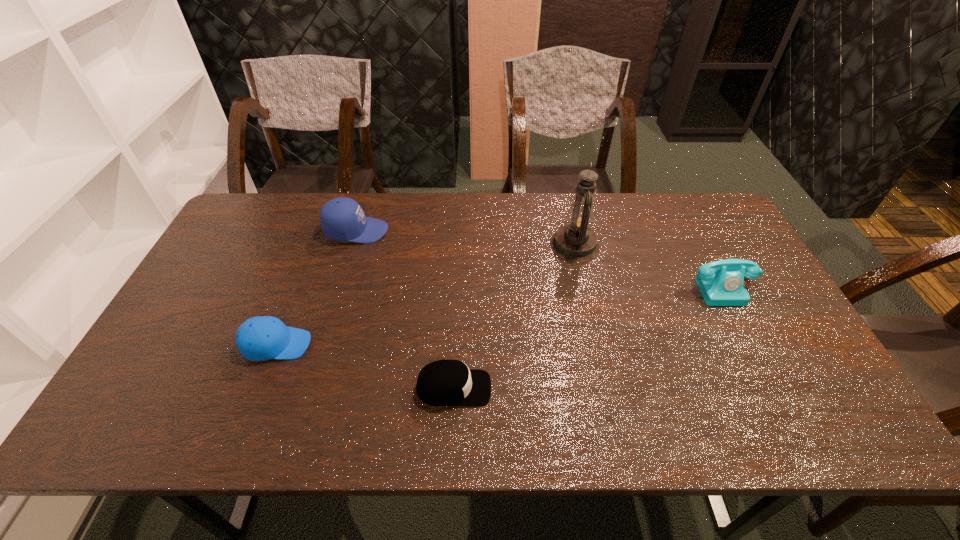
Identify the location of vacant region at the far left corner of the desktop. The height and width of the screenshot is (540, 960). (279, 199).

This screenshot has height=540, width=960. In the image, there is a desktop. Identify the location of vacant space at the far right corner. (689, 218).

Image resolution: width=960 pixels, height=540 pixels. I want to click on vacant area at the near right corner, so click(787, 410).

You are a GUI agent. You are given a task and a screenshot of the screen. Output one action in this format:
    pyautogui.click(x=<x>, y=<y>)
    Task: Click on the free spot between the fourth farthest object and the telephone
    This screenshot has width=960, height=540.
    Given the screenshot: What is the action you would take?
    pyautogui.click(x=500, y=316)

This screenshot has height=540, width=960. I want to click on empty space that is in between the third object from right to left and the tallest cap, so click(x=405, y=309).

The height and width of the screenshot is (540, 960). I want to click on free space between the oil lamp and the third object from right to left, so click(515, 317).

Where is `empty space that is in between the tallest cap and the oil lamp`? This screenshot has height=540, width=960. empty space that is in between the tallest cap and the oil lamp is located at coordinates (466, 238).

In order to click on empty space between the third object from left to right and the fourth farthest object in this screenshot , I will do `click(365, 366)`.

Locate an element on the screen. The height and width of the screenshot is (540, 960). free spot between the fourth farthest object and the rightmost cap is located at coordinates (365, 366).

The width and height of the screenshot is (960, 540). Identify the location of vacant region between the tallest cap and the second nearest object. (317, 288).